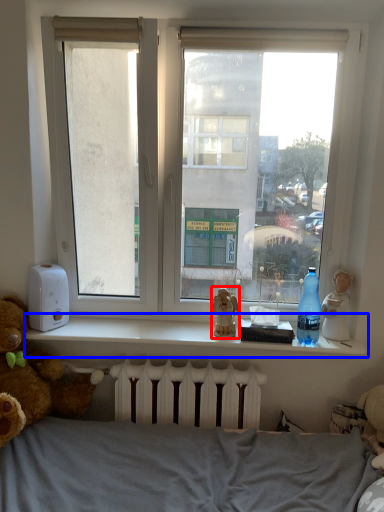
Question: Which point is further to the camera, figurine (highlighted by a red box) or window sill (highlighted by a blue box)?

Choices:
 (A) figurine
 (B) window sill

Answer: (A)